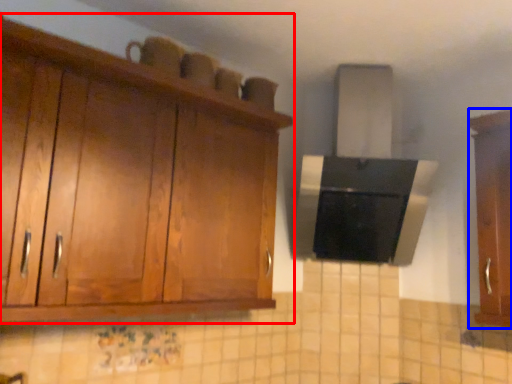
Question: Which object is further to the camera taking this photo, cabinetry (highlighted by a red box) or cabinetry (highlighted by a blue box)?

Choices:
 (A) cabinetry
 (B) cabinetry

Answer: (B)